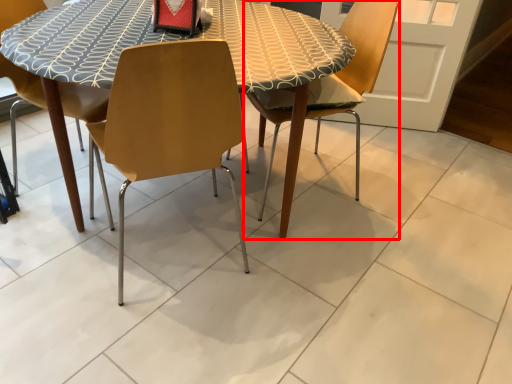
Question: From the image's perspective, considering the relative positions of chair (annotated by the red box) and chair in the image provided, where is chair (annotated by the red box) located with respect to the staircase?

Choices:
 (A) below
 (B) above

Answer: (B)